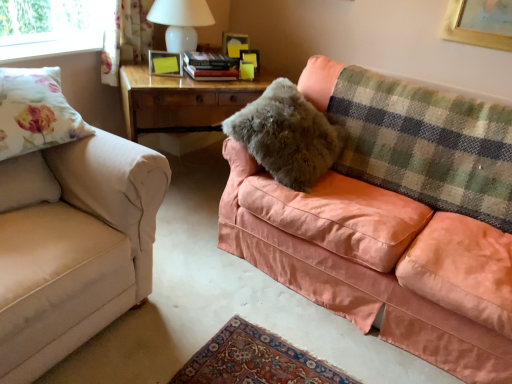
Question: From a real-world perspective, is wooden table at center on beige fabric couch at left, marked as the 2th studio couch in a right-to-left arrangement?

Choices:
 (A) no
 (B) yes

Answer: (A)

Question: Does wooden table at center lie behind beige fabric couch at left, marked as the 2th studio couch in a right-to-left arrangement?

Choices:
 (A) yes
 (B) no

Answer: (A)

Question: Is wooden table at center positioned beyond the bounds of beige fabric couch at left, marked as the 2th studio couch in a right-to-left arrangement?

Choices:
 (A) yes
 (B) no

Answer: (A)

Question: Is wooden table at center smaller than beige fabric couch at left, marked as the 2th studio couch in a right-to-left arrangement?

Choices:
 (A) yes
 (B) no

Answer: (A)

Question: Considering the relative sizes of wooden table at center and beige fabric couch at left, arranged as the 1th studio couch when viewed from the left, in the image provided, is wooden table at center wider than beige fabric couch at left, arranged as the 1th studio couch when viewed from the left,?

Choices:
 (A) no
 (B) yes

Answer: (A)

Question: From the image's perspective, is beige fabric couch at left, arranged as the 1th studio couch when viewed from the left, positioned above or below matte yellow picture frame at center, the first picture frame viewed from the front?

Choices:
 (A) below
 (B) above

Answer: (A)

Question: Would you say beige fabric couch at left, marked as the 2th studio couch in a right-to-left arrangement, is to the left or to the right of matte yellow picture frame at center, the first picture frame from the bottom, in the picture?

Choices:
 (A) left
 (B) right

Answer: (A)

Question: Looking at their shapes, would you say beige fabric couch at left, arranged as the 1th studio couch when viewed from the left, is wider or thinner than matte yellow picture frame at center, placed as the second picture frame when sorted from back to front?

Choices:
 (A) wide
 (B) thin

Answer: (A)

Question: Do you think beige fabric couch at left, marked as the 2th studio couch in a right-to-left arrangement, is within matte yellow picture frame at center, which ranks as the second picture frame in right-to-left order, or outside of it?

Choices:
 (A) inside
 (B) outside

Answer: (B)

Question: Do you think fuzzy gray pillow at upper right, which ranks as the 1th pillow in back-to-front order, is within floral fabric pillow at left, or outside of it?

Choices:
 (A) inside
 (B) outside

Answer: (B)

Question: Is fuzzy gray pillow at upper right, the first pillow in the right-to-left sequence, wider or thinner than floral fabric pillow at left?

Choices:
 (A) wide
 (B) thin

Answer: (A)

Question: In terms of size, does fuzzy gray pillow at upper right, which ranks as the 1th pillow in back-to-front order, appear bigger or smaller than floral fabric pillow at left?

Choices:
 (A) big
 (B) small

Answer: (A)

Question: From the image's perspective, is fuzzy gray pillow at upper right, the 2th pillow in the left-to-right sequence, above or below floral fabric pillow at left?

Choices:
 (A) below
 (B) above

Answer: (A)

Question: Is point (160, 69) positioned closer to the camera than point (113, 48)?

Choices:
 (A) farther
 (B) closer

Answer: (B)

Question: Considering their positions, is matte yellow picture frame at center, placed as the first picture frame when sorted from left to right, located in front of or behind floral fabric curtain at upper left?

Choices:
 (A) front
 (B) behind

Answer: (B)